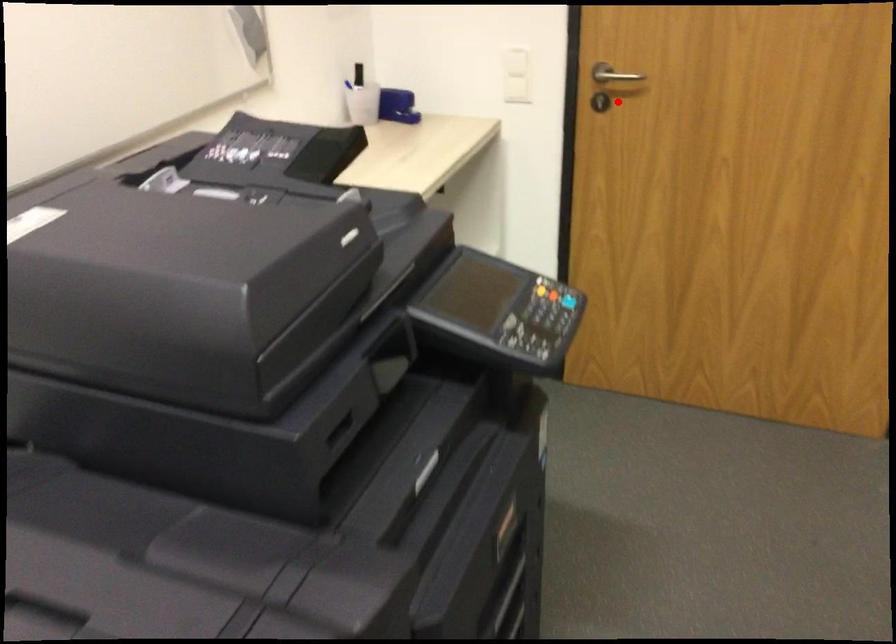
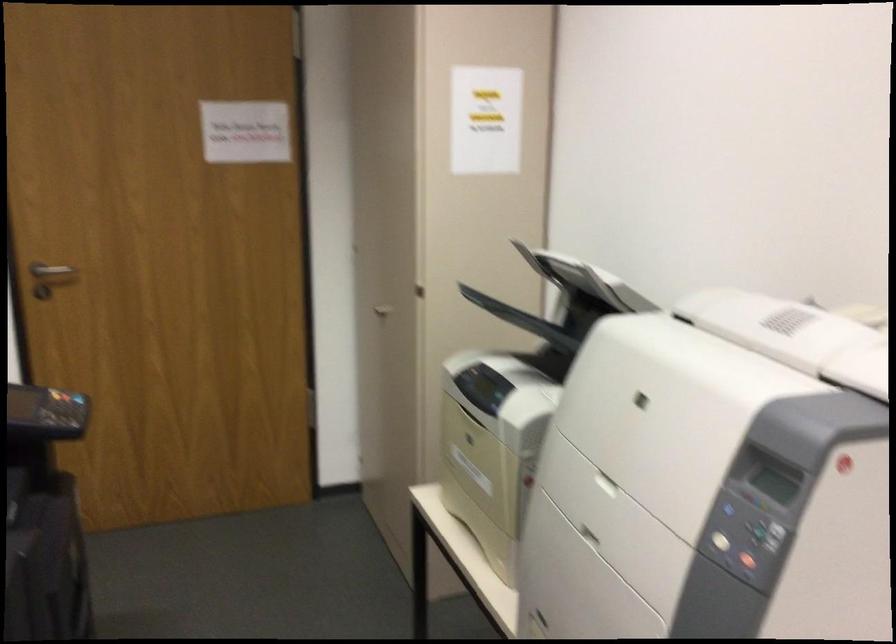
Question: I am providing you with two images of the same scene from different viewpoints. A red point is shown in image1. For the corresponding object point in image2, is it positioned nearer or farther from the camera?

Choices:
 (A) Nearer
 (B) Farther

Answer: (B)